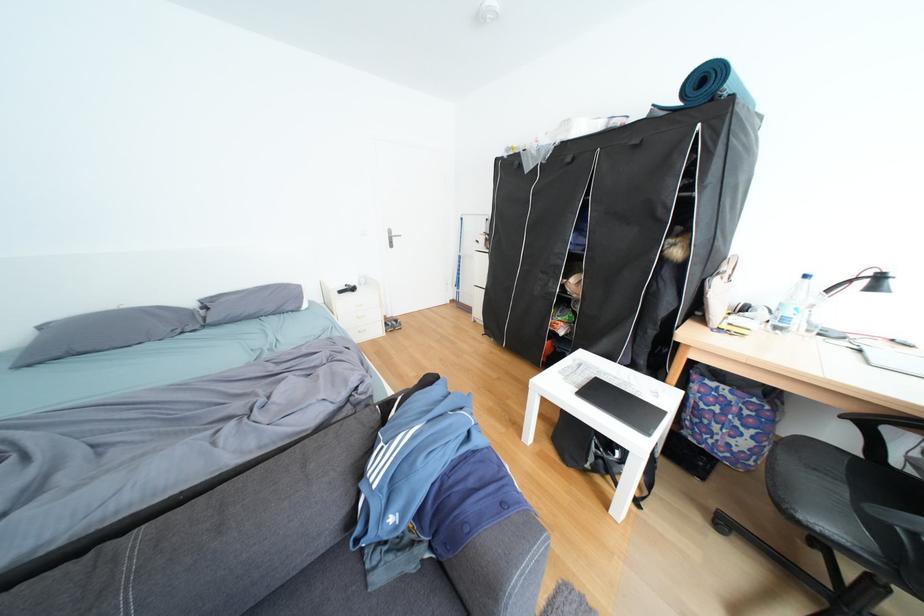
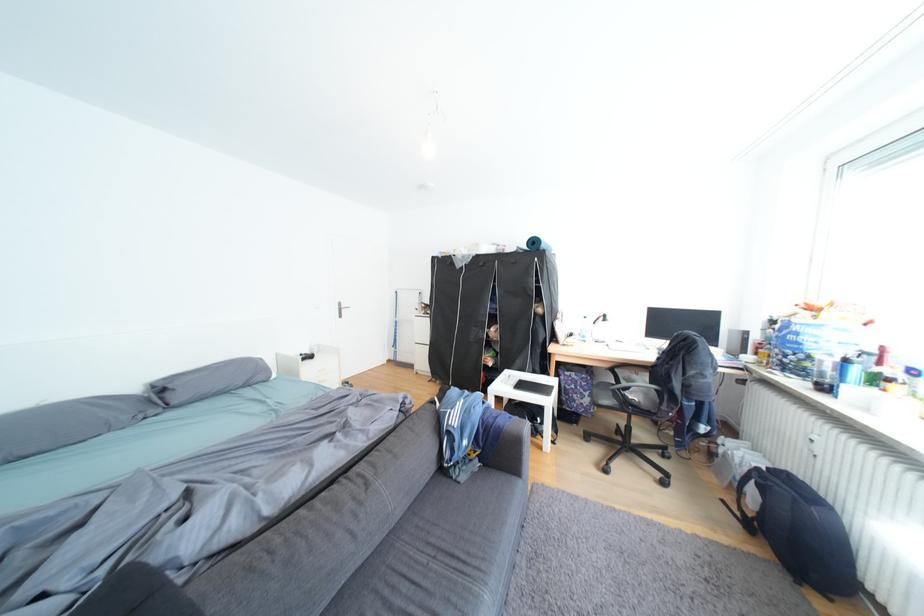
Where in the second image is the point corresponding to pixel 772 315 from the first image?

(590, 337)